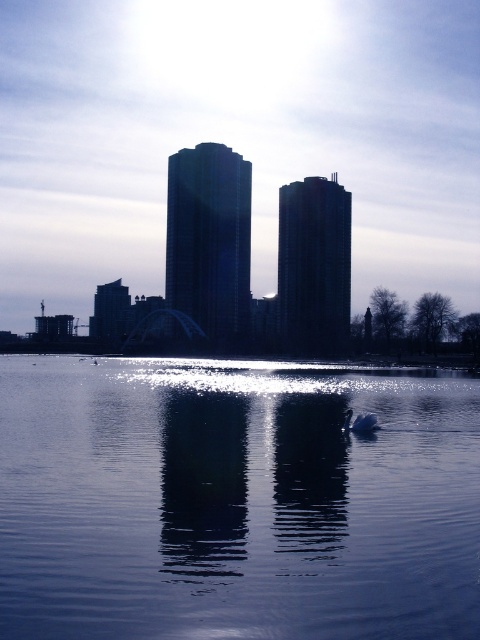
Question: Is clear water at center positioned before white glossy swan at lower center?

Choices:
 (A) no
 (B) yes

Answer: (B)

Question: Does clear water at center appear over white glossy swan at lower center?

Choices:
 (A) yes
 (B) no

Answer: (B)

Question: Which point is farther to the camera?

Choices:
 (A) white glossy swan at lower center
 (B) clear water at center

Answer: (A)

Question: Among these objects, which one is nearest to the camera?

Choices:
 (A) white glossy swan at lower center
 (B) clear water at center

Answer: (B)

Question: Which of the following is the closest to the observer?

Choices:
 (A) white glossy swan at lower center
 (B) clear water at center

Answer: (B)

Question: Is the position of clear water at center less distant than that of white glossy swan at lower center?

Choices:
 (A) yes
 (B) no

Answer: (A)